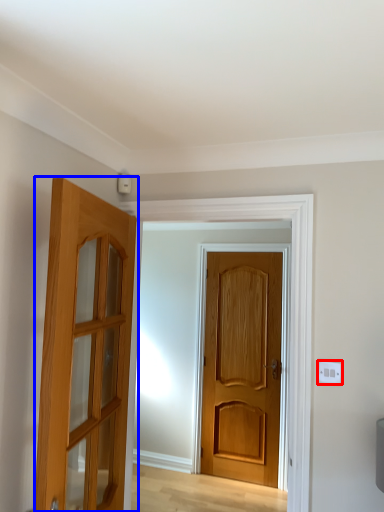
Question: Which point is closer to the camera, electric outlet (highlighted by a red box) or door (highlighted by a blue box)?

Choices:
 (A) electric outlet
 (B) door

Answer: (B)